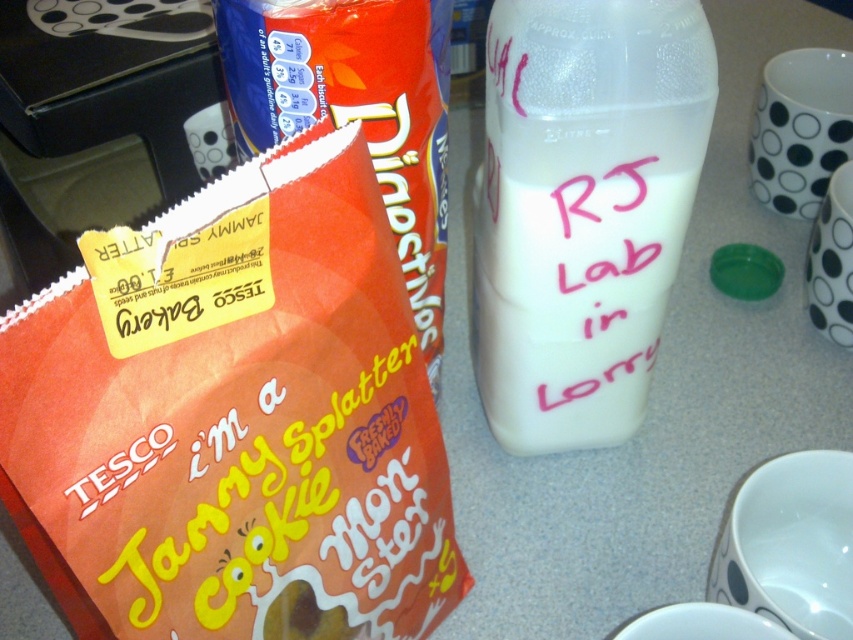
You are organizing items on a kitchen counter and have an orange paper bag at left and a white opaque milk at center. Which item takes up more space on the counter?

The orange paper bag at left is larger in size than the white opaque milk at center, so it takes up more space on the counter.

You are a delivery person who needs to place a new item exactly at the point marked at coordinates point (x=503, y=259) on the kitchen countertop. The item you are placing is 12 inches tall. Will the item fit without exceeding the height of the countertop?

The distance of point (x=503, y=259) from camera is 32.84 inches. Since the item is 12 inches tall, it will fit as long as the total height from the countertop to the top of the item does not exceed the countertop height. However, without knowing the countertop height, we cannot confirm if the item will fit vertically. The question only provides the distance from the camera, which relates to depth, not height.